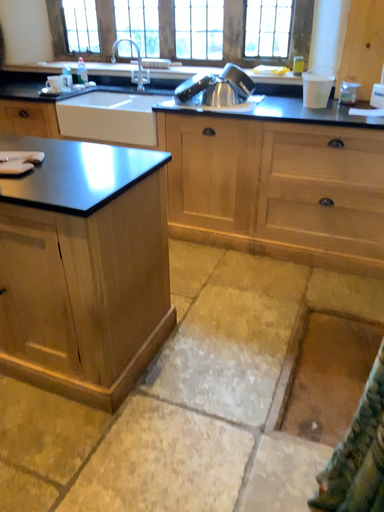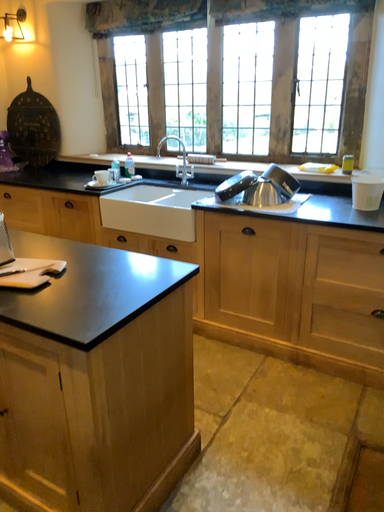
Question: How did the camera likely rotate when shooting the video?

Choices:
 (A) rotated upward
 (B) rotated downward

Answer: (A)